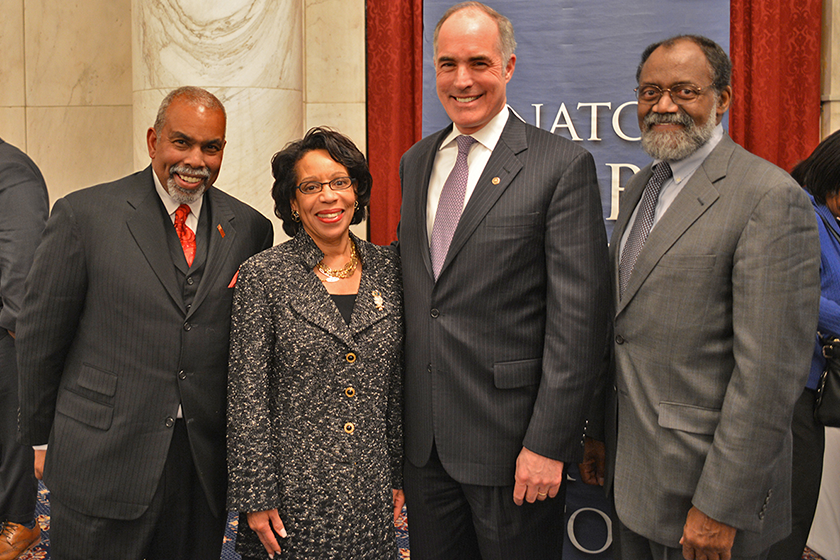
You are a GUI agent. You are given a task and a screenshot of the screen. Output one action in this format:
    pyautogui.click(x=<x>, y=<y>)
    Task: Click on the column
    
    Given the screenshot: What is the action you would take?
    pyautogui.click(x=244, y=128)